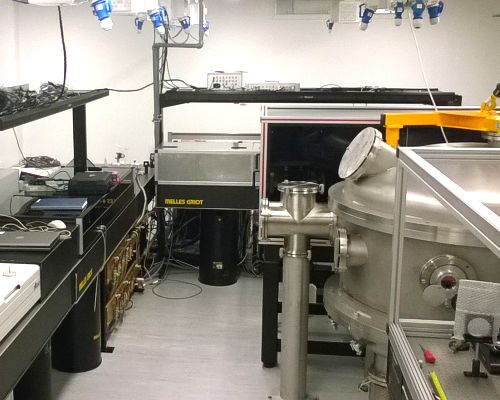
The image size is (500, 400). In order to click on black surface table in this screenshot , I will do `click(21, 252)`.